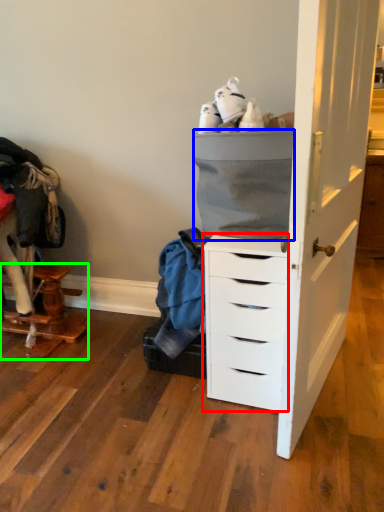
Question: Which object is positioned closest to chest of drawers (highlighted by a red box)? Select from cabinetry (highlighted by a blue box) and furniture (highlighted by a green box).

Choices:
 (A) cabinetry
 (B) furniture

Answer: (A)